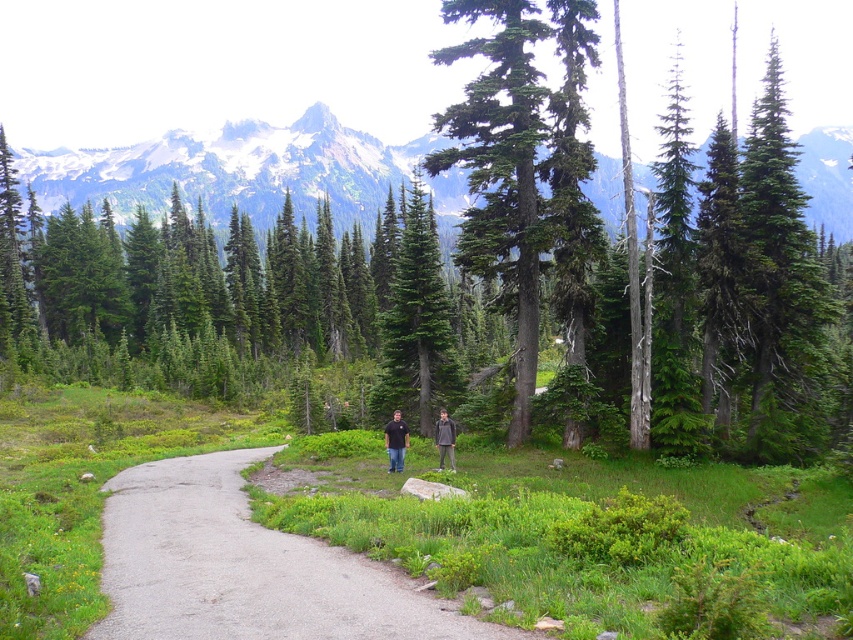
Does gray asphalt trail at center have a larger size compared to green coniferous forest at upper center?

Incorrect, gray asphalt trail at center is not larger than green coniferous forest at upper center.

Can you confirm if gray asphalt trail at center is shorter than green coniferous forest at upper center?

Yes.

The width and height of the screenshot is (853, 640). I want to click on gray asphalt trail at center, so click(x=247, y=566).

Is point (341, 129) less distant than point (399, 419)?

No, (341, 129) is behind (399, 419).

Does green coniferous forest at upper center appear on the right side of black cotton shirt at center?

Yes, green coniferous forest at upper center is to the right of black cotton shirt at center.

Between point (300, 147) and point (402, 420), which one is positioned in front?

Point (402, 420)

Identify the location of green coniferous forest at upper center. (234, 170).

Can you confirm if gray asphalt trail at center is positioned to the right of green matte tree at center?

Indeed, gray asphalt trail at center is positioned on the right side of green matte tree at center.

Is point (219, 506) less distant than point (421, 400)?

That is True.

Where is `gray asphalt trail at center`? This screenshot has width=853, height=640. gray asphalt trail at center is located at coordinates (247, 566).